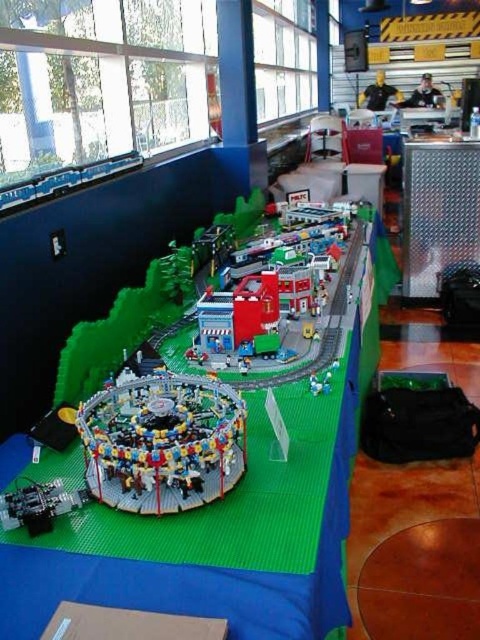
Question: Which of the following is the closest to the observer?

Choices:
 (A) metallic gray train at lower left
 (B) translucent plastic carousel at center
 (C) matte blue plastic building at center
 (D) brick red train station at center

Answer: (B)

Question: Is translucent plastic carousel at center to the left of metallic gray train at lower left from the viewer's perspective?

Choices:
 (A) no
 (B) yes

Answer: (A)

Question: Which of these objects is positioned farthest from the translucent plastic carousel at center?

Choices:
 (A) brick red train station at center
 (B) metallic gray train at lower left
 (C) matte blue plastic building at center

Answer: (A)

Question: Estimate the real-world distances between objects in this image. Which object is farther from the translucent plastic carousel at center?

Choices:
 (A) brick red train station at center
 (B) metallic gray train at lower left
 (C) matte blue plastic building at center

Answer: (A)

Question: Does translucent plastic carousel at center appear over matte blue plastic building at center?

Choices:
 (A) yes
 (B) no

Answer: (B)

Question: Does translucent plastic carousel at center appear under metallic gray train at lower left?

Choices:
 (A) yes
 (B) no

Answer: (B)